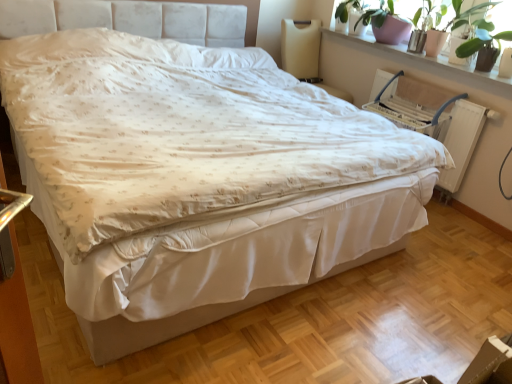
Question: From a real-world perspective, is beige fabric swivel chair at upper right on top of green glossy plant at upper right, which is the first plant in back-to-front order?

Choices:
 (A) no
 (B) yes

Answer: (A)

Question: Considering the relative positions of beige fabric swivel chair at upper right and green glossy plant at upper right, which is the first plant in back-to-front order, in the image provided, is beige fabric swivel chair at upper right in front of green glossy plant at upper right, which is the first plant in back-to-front order,?

Choices:
 (A) no
 (B) yes

Answer: (A)

Question: Can you confirm if beige fabric swivel chair at upper right is wider than green glossy plant at upper right, the 2th plant positioned from the front?

Choices:
 (A) no
 (B) yes

Answer: (B)

Question: Does beige fabric swivel chair at upper right touch green glossy plant at upper right, the 2th plant positioned from the front?

Choices:
 (A) yes
 (B) no

Answer: (B)

Question: Considering the relative sizes of beige fabric swivel chair at upper right and green glossy plant at upper right, which is the first plant in back-to-front order, in the image provided, is beige fabric swivel chair at upper right thinner than green glossy plant at upper right, which is the first plant in back-to-front order,?

Choices:
 (A) yes
 (B) no

Answer: (B)

Question: Considering the relative sizes of beige fabric swivel chair at upper right and green glossy plant at upper right, which is the first plant in back-to-front order, in the image provided, is beige fabric swivel chair at upper right taller than green glossy plant at upper right, which is the first plant in back-to-front order,?

Choices:
 (A) yes
 (B) no

Answer: (A)

Question: From the image's perspective, is green leafy plant at upper right, the 2th plant viewed from the back, over beige fabric swivel chair at upper right?

Choices:
 (A) no
 (B) yes

Answer: (A)

Question: Does green leafy plant at upper right, the first plant in the front-to-back sequence, lie in front of beige fabric swivel chair at upper right?

Choices:
 (A) yes
 (B) no

Answer: (A)

Question: Is green leafy plant at upper right, the 2th plant viewed from the back, completely or partially outside of beige fabric swivel chair at upper right?

Choices:
 (A) no
 (B) yes

Answer: (B)

Question: Does green leafy plant at upper right, the first plant in the front-to-back sequence, have a smaller size compared to beige fabric swivel chair at upper right?

Choices:
 (A) no
 (B) yes

Answer: (B)

Question: Are green leafy plant at upper right, the first plant in the front-to-back sequence, and beige fabric swivel chair at upper right far apart?

Choices:
 (A) no
 (B) yes

Answer: (B)

Question: Is green leafy plant at upper right, the first plant in the front-to-back sequence, at the left side of beige fabric swivel chair at upper right?

Choices:
 (A) no
 (B) yes

Answer: (A)

Question: Is white wood window sill at upper right positioned beyond the bounds of green glossy plant at upper right, the 2th plant positioned from the front?

Choices:
 (A) yes
 (B) no

Answer: (A)